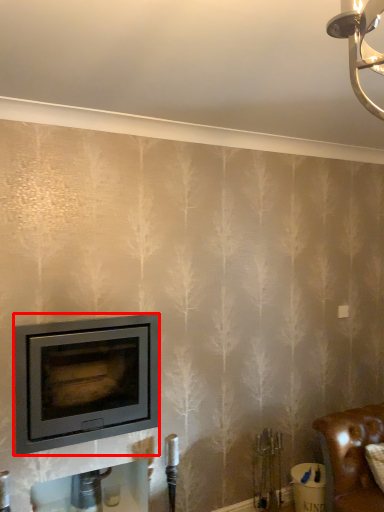
Question: Where is wood burning stove (annotated by the red box) located in relation to furniture in the image?

Choices:
 (A) right
 (B) left

Answer: (B)